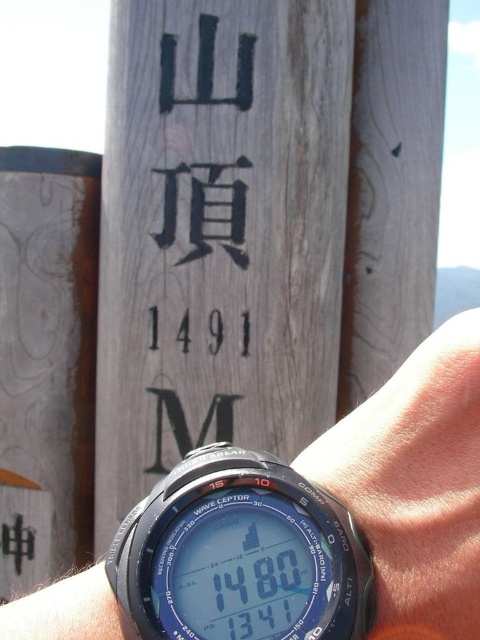
You are trying to determine which part of the watch is closer to you. You notice the black plastic digital watch at center and the black rubber watch at center. Which one is positioned higher?

The black plastic digital watch at center is positioned higher than the black rubber watch at center.

You are looking at the watch and the wooden post in the scene. Based on the coordinates given, is the point at (277, 579) closer to you than the point at (421, 472)?

Yes, the point at (277, 579) is in front of the point at (421, 472), so it is closer to you.

You are a photographer trying to capture a clear image of the black plastic digital watch at center. The focus distance of your camera is set to 25 centimeters. Will the watch be in focus?

The black plastic digital watch at center is 25.94 centimeters from the camera, which is slightly beyond the focus distance of 25 centimeters. Therefore, the watch may not be in focus.